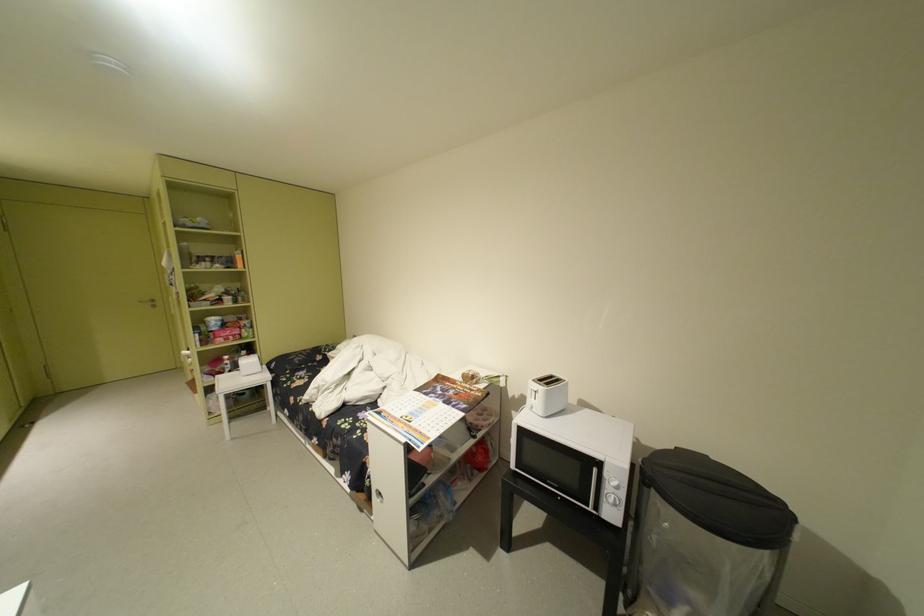
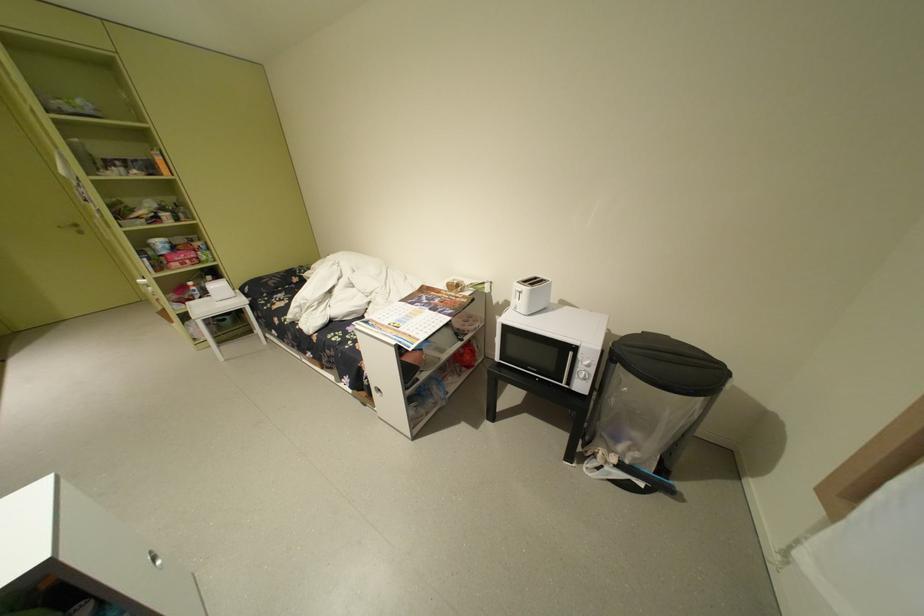
Find the pixel in the second image that matches point 542,398 in the first image.

(527, 299)